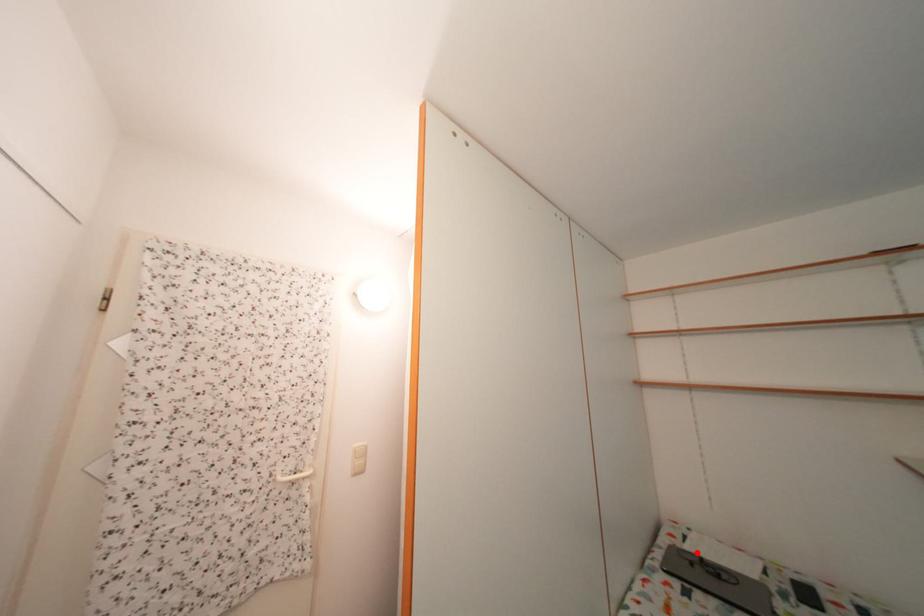
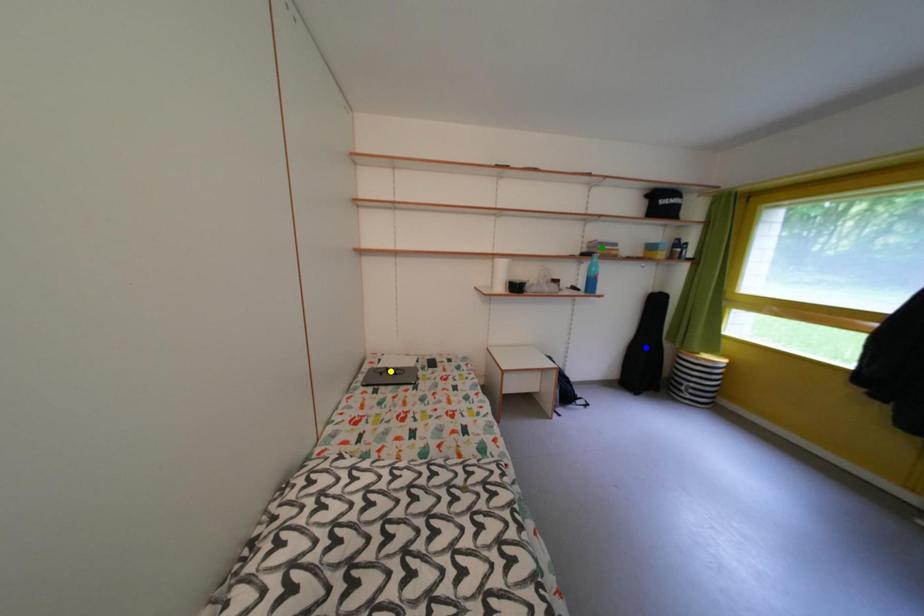
Question: I am providing you with two images of the same scene from different viewpoints. A red point is marked on the first image. You are given multiple points on the second image. Which mark in image 2 goes with the point in image 1?

Choices:
 (A) yellow point
 (B) blue point
 (C) green point

Answer: (A)